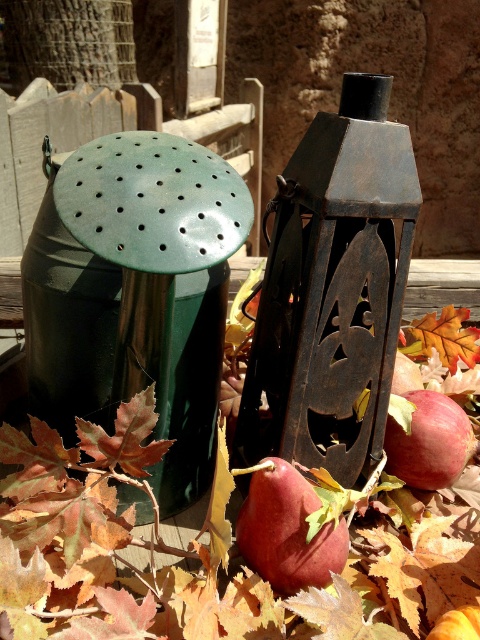
Is shiny red apple at center smaller than matte red apple at lower right?

Incorrect, shiny red apple at center is not smaller in size than matte red apple at lower right.

Does shiny red apple at center appear under matte red apple at lower right?

Yes, shiny red apple at center is below matte red apple at lower right.

Which is in front, point (256, 516) or point (423, 410)?

Point (256, 516)

Find the location of a particular element. The height and width of the screenshot is (640, 480). shiny red apple at center is located at coordinates (287, 529).

What are the coordinates of `shiny red apple at center` in the screenshot? It's located at (287, 529).

Who is positioned more to the left, shiny red apple at center or orange matte maple leaf at lower right?

shiny red apple at center is more to the left.

Which is in front, point (301, 580) or point (444, 324)?

Point (301, 580) is in front.

Locate an element on the screen. shiny red apple at center is located at coordinates (287, 529).

Does matte red apple at lower right appear on the right side of orange matte maple leaf at lower right?

In fact, matte red apple at lower right is to the left of orange matte maple leaf at lower right.

Which is above, matte red apple at lower right or orange matte maple leaf at lower right?

orange matte maple leaf at lower right is higher up.

Does point (441, 484) come closer to viewer compared to point (472, 336)?

Yes, point (441, 484) is closer to viewer.

The width and height of the screenshot is (480, 640). I want to click on matte red apple at lower right, so click(430, 442).